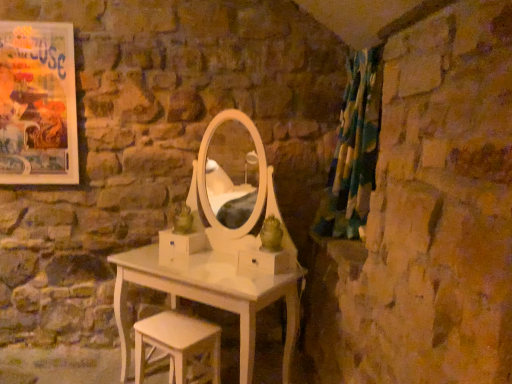
Question: Should I look upward or downward to see multicolored fabric curtain at right?

Choices:
 (A) down
 (B) up

Answer: (B)

Question: From the image's perspective, is multicolored fabric curtain at right under white wood stool at lower center?

Choices:
 (A) no
 (B) yes

Answer: (A)

Question: From the image's perspective, is multicolored fabric curtain at right located above white wood stool at lower center?

Choices:
 (A) no
 (B) yes

Answer: (B)

Question: Does multicolored fabric curtain at right contain white wood stool at lower center?

Choices:
 (A) no
 (B) yes

Answer: (A)

Question: Is multicolored fabric curtain at right with white wood stool at lower center?

Choices:
 (A) no
 (B) yes

Answer: (A)

Question: Considering the relative sizes of multicolored fabric curtain at right and white wood stool at lower center in the image provided, is multicolored fabric curtain at right smaller than white wood stool at lower center?

Choices:
 (A) yes
 (B) no

Answer: (B)

Question: Are multicolored fabric curtain at right and white wood stool at lower center far apart?

Choices:
 (A) no
 (B) yes

Answer: (B)

Question: Is multicolored fabric curtain at right thinner than matte paper poster at upper left?

Choices:
 (A) yes
 (B) no

Answer: (B)

Question: Is multicolored fabric curtain at right facing towards matte paper poster at upper left?

Choices:
 (A) no
 (B) yes

Answer: (B)

Question: Does multicolored fabric curtain at right appear on the right side of matte paper poster at upper left?

Choices:
 (A) no
 (B) yes

Answer: (B)

Question: Considering the relative sizes of multicolored fabric curtain at right and matte paper poster at upper left in the image provided, is multicolored fabric curtain at right wider than matte paper poster at upper left?

Choices:
 (A) no
 (B) yes

Answer: (B)

Question: From the image's perspective, does multicolored fabric curtain at right appear higher than matte paper poster at upper left?

Choices:
 (A) yes
 (B) no

Answer: (B)

Question: Does multicolored fabric curtain at right have a lesser height compared to matte paper poster at upper left?

Choices:
 (A) yes
 (B) no

Answer: (B)

Question: Would you say matte paper poster at upper left is outside multicolored fabric curtain at right?

Choices:
 (A) no
 (B) yes

Answer: (B)